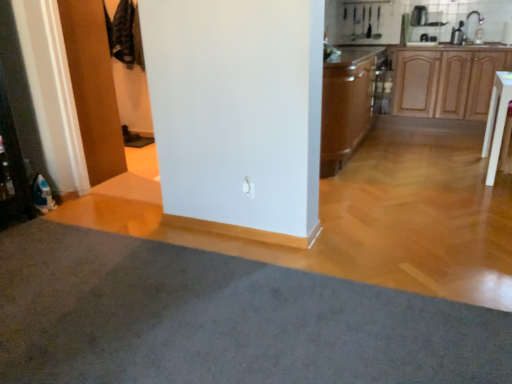
Question: Is wooden door at left wider or thinner than brown wood cabinet at center, positioned as the 2th cabinetry in right-to-left order?

Choices:
 (A) thin
 (B) wide

Answer: (A)

Question: From the image's perspective, is wooden door at left located above or below brown wood cabinet at center, positioned as the first cabinetry in left-to-right order?

Choices:
 (A) below
 (B) above

Answer: (B)

Question: Considering the real-world distances, which object is farthest from the white glossy table at upper right?

Choices:
 (A) wooden door at left
 (B) brown wood cabinet at center, positioned as the first cabinetry in left-to-right order
 (C) wooden cabinet at right, the 1th cabinetry in the right-to-left sequence
 (D) wooden at upper right
 (E) white glossy sink at upper right

Answer: (A)

Question: Estimate the real-world distances between objects in this image. Which object is farther from the white glossy table at upper right?

Choices:
 (A) gray carpet at lower left
 (B) brown wood cabinet at center, positioned as the 2th cabinetry in right-to-left order
 (C) wooden door at left
 (D) wooden cabinet at right, which is the second cabinetry in left-to-right order
 (E) wooden at upper right

Answer: (C)